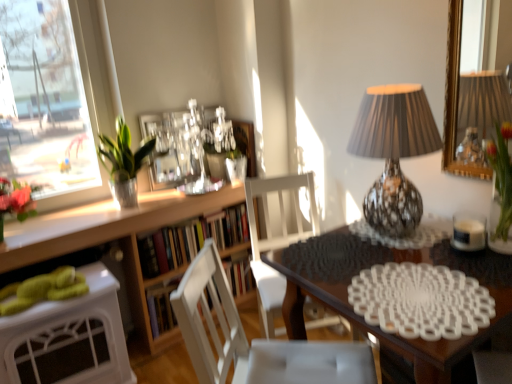
Question: From a real-world perspective, is white glass candle at right positioned above or below wooden bookshelf at center?

Choices:
 (A) below
 (B) above

Answer: (B)

Question: Is point (474, 218) closer or farther from the camera than point (174, 319)?

Choices:
 (A) closer
 (B) farther

Answer: (A)

Question: Based on their relative distances, which object is nearer to the wooden bookshelf at center?

Choices:
 (A) wooden bookshelf at center
 (B) white wood chair at center, arranged as the 1th chair when viewed from the front
 (C) white matte chair at center, arranged as the 1th chair when viewed from the back
 (D) green leafy plant in glass vase at upper left
 (E) green glass vase at upper right

Answer: (A)

Question: Which object is positioned farthest from the green glass vase at upper right?

Choices:
 (A) white wood chair at center, arranged as the 1th chair when viewed from the front
 (B) white glass candle at right
 (C) shiny metallic lamp at upper right
 (D) wooden bookshelf at center
 (E) wooden bookshelf at center

Answer: (D)